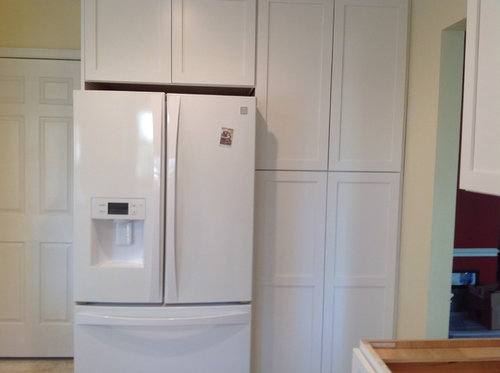
At what (x,y) coordinates should I click in order to perform the action: click on refrigerator handle. Please return your answer as a coordinate pair (x, y). This screenshot has width=500, height=373. Looking at the image, I should click on (169, 226), (155, 225).